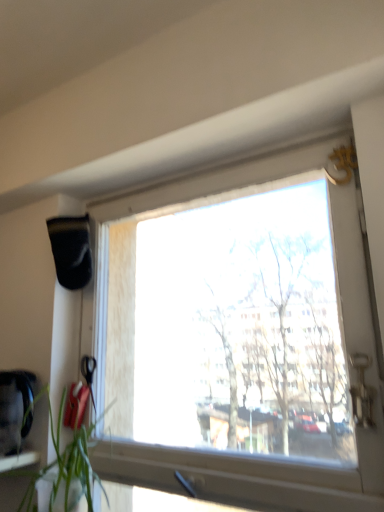
Question: From a real-world perspective, is transparent glass window at center positioned above or below green leafy plant at lower left?

Choices:
 (A) below
 (B) above

Answer: (B)

Question: From the image's perspective, is transparent glass window at center located above or below green leafy plant at lower left?

Choices:
 (A) above
 (B) below

Answer: (A)

Question: Visually, is transparent glass window at center positioned to the left or to the right of green leafy plant at lower left?

Choices:
 (A) right
 (B) left

Answer: (A)

Question: In the image, is green leafy plant at lower left on the left side or the right side of transparent glass window at center?

Choices:
 (A) left
 (B) right

Answer: (A)

Question: Considering the positions of green leafy plant at lower left and transparent glass window at center in the image, is green leafy plant at lower left taller or shorter than transparent glass window at center?

Choices:
 (A) short
 (B) tall

Answer: (A)

Question: Is green leafy plant at lower left wider or thinner than transparent glass window at center?

Choices:
 (A) thin
 (B) wide

Answer: (B)

Question: Does point (89, 442) appear closer or farther from the camera than point (203, 465)?

Choices:
 (A) farther
 (B) closer

Answer: (A)